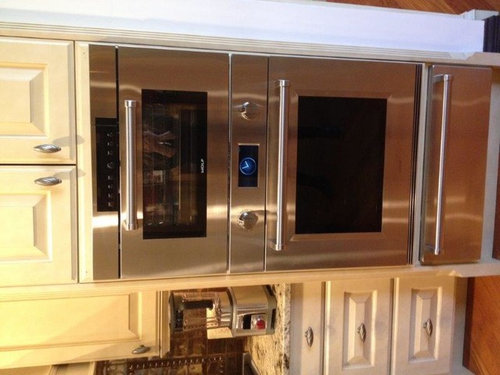
Find the location of a particular element. cabinet is located at coordinates pyautogui.click(x=26, y=235), pyautogui.click(x=16, y=111).